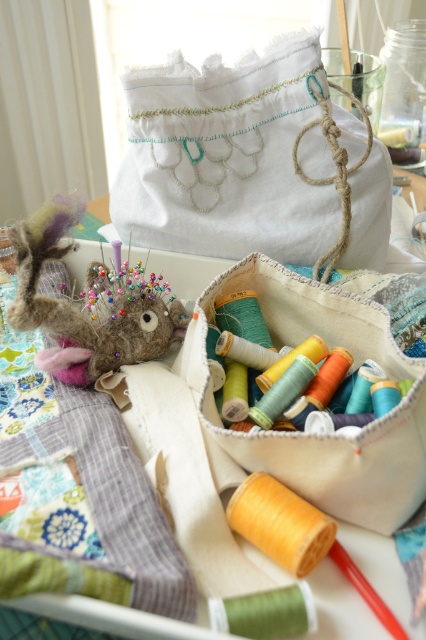
Question: Among these objects, which one is nearest to the camera?

Choices:
 (A) canvas spools at center
 (B) fuzzy brown stuffed animal at left
 (C) white fabric pouch at upper center

Answer: (A)

Question: Is white fabric pouch at upper center closer to the viewer compared to fuzzy brown stuffed animal at left?

Choices:
 (A) yes
 (B) no

Answer: (B)

Question: Among these objects, which one is nearest to the camera?

Choices:
 (A) white fabric pouch at upper center
 (B) fuzzy brown stuffed animal at left

Answer: (B)

Question: Which point is farther to the camera?

Choices:
 (A) tap(325, 104)
 (B) tap(74, 312)
 (C) tap(198, 342)

Answer: (A)

Question: Can you confirm if canvas spools at center is positioned to the right of fuzzy brown stuffed animal at left?

Choices:
 (A) yes
 (B) no

Answer: (A)

Question: Is white fabric pouch at upper center to the left of fuzzy brown stuffed animal at left from the viewer's perspective?

Choices:
 (A) yes
 (B) no

Answer: (B)